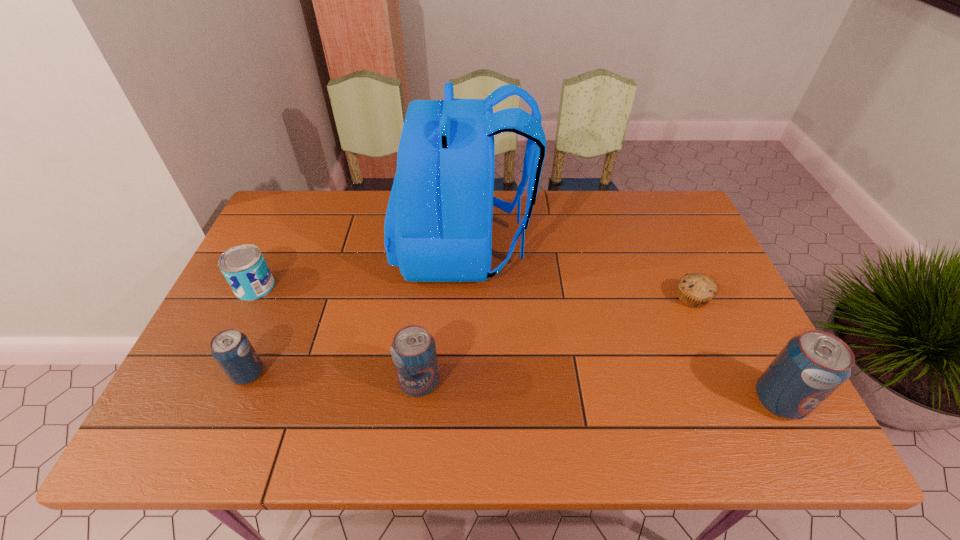
Where is `object present at the near right corner`? object present at the near right corner is located at coordinates (813, 365).

Where is `vacant space at the far edge of the desktop`? This screenshot has height=540, width=960. vacant space at the far edge of the desktop is located at coordinates (572, 215).

Locate an element on the screen. This screenshot has width=960, height=540. free space at the near edge is located at coordinates (308, 374).

The height and width of the screenshot is (540, 960). In the image, there is a desktop. In order to click on vacant space at the left edge in this screenshot , I will do `click(240, 300)`.

In the image, there is a desktop. Where is `free space at the right edge`? free space at the right edge is located at coordinates (677, 281).

The height and width of the screenshot is (540, 960). Identify the location of vacant space at the far left corner of the desktop. (317, 226).

I want to click on blank space at the far right corner, so tap(694, 228).

Locate an element on the screen. Image resolution: width=960 pixels, height=540 pixels. vacant region between the muffin and the second tallest object is located at coordinates (735, 349).

Identify the location of free space between the backpack and the shortest object. The height and width of the screenshot is (540, 960). (578, 273).

I want to click on unoccupied area between the backpack and the rightmost pop soda, so click(x=621, y=323).